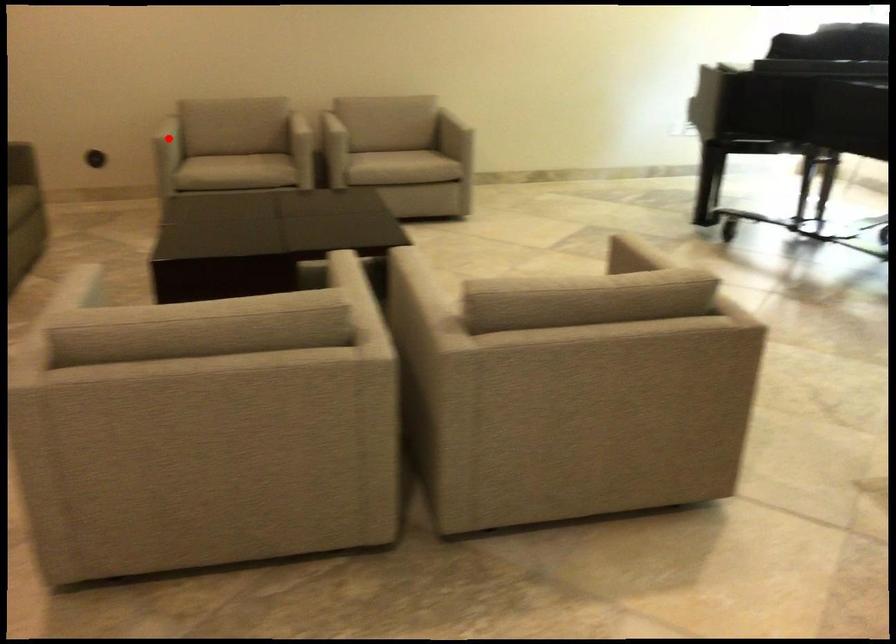
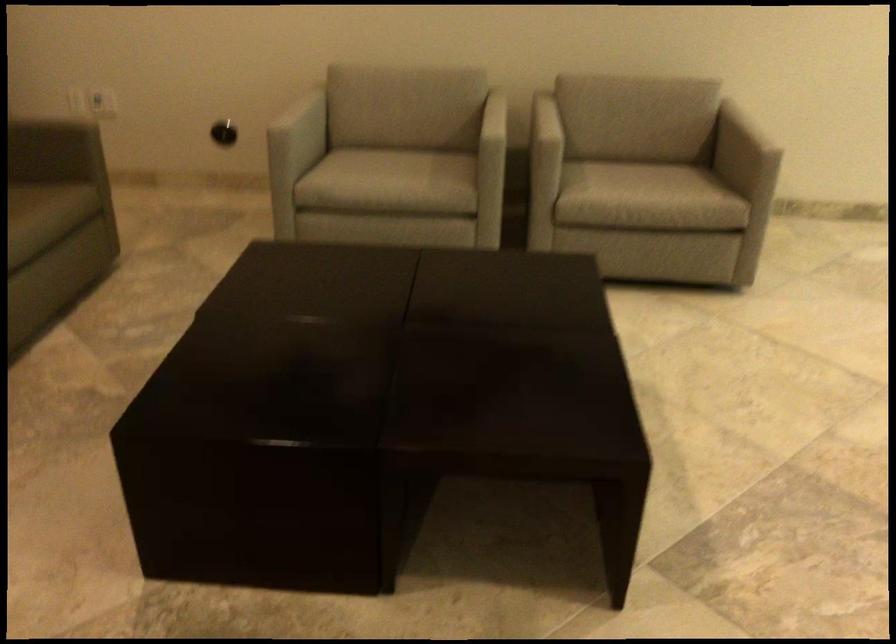
Question: I am providing you with two images of the same scene from different viewpoints. A red point is shown in image1. For the corresponding object point in image2, is it positioned nearer or farther from the camera?

Choices:
 (A) Nearer
 (B) Farther

Answer: (A)